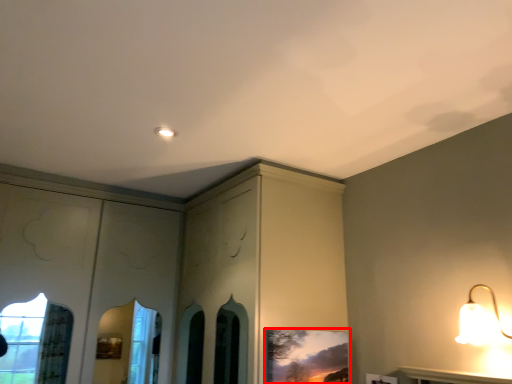
Question: From the image's perspective, what is the correct spatial relationship of picture frame (annotated by the red box) in relation to lamp?

Choices:
 (A) above
 (B) below

Answer: (B)